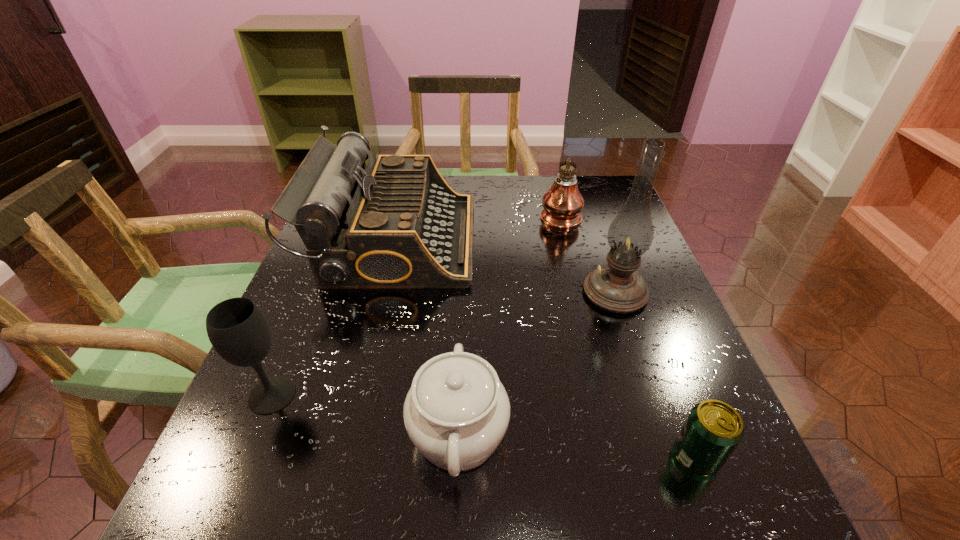
You are a GUI agent. You are given a task and a screenshot of the screen. Output one action in this format:
    pyautogui.click(x=<x>, y=<y>)
    Task: Click on the taller oil lamp
    
    Given the screenshot: What is the action you would take?
    pyautogui.click(x=617, y=287)

At what (x,y) coordinates should I click in order to perform the action: click on the tallest object. Please return your answer as a coordinate pair (x, y). This screenshot has width=960, height=540. Looking at the image, I should click on (617, 287).

The width and height of the screenshot is (960, 540). What are the coordinates of `the second tallest object` in the screenshot? It's located at (563, 202).

Locate an element on the screen. Image resolution: width=960 pixels, height=540 pixels. the farther oil lamp is located at coordinates (563, 202).

Where is `typewriter`? typewriter is located at coordinates (396, 224).

Locate an element on the screen. The image size is (960, 540). wineglass is located at coordinates (238, 330).

Find the location of a particular element. This screenshot has height=540, width=960. chinaware is located at coordinates (456, 413).

Locate an element on the screen. beer can is located at coordinates (712, 431).

The image size is (960, 540). Find the location of `free region located on the left of the tallest object`. free region located on the left of the tallest object is located at coordinates (546, 292).

This screenshot has height=540, width=960. Find the location of `free space located 0.360m on the left of the second tallest object`. free space located 0.360m on the left of the second tallest object is located at coordinates (404, 215).